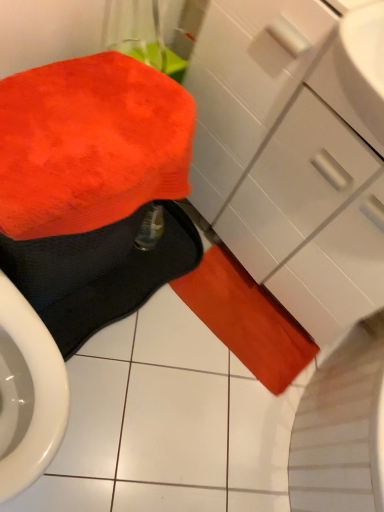
Question: Considering the relative positions of fluffy orange towel at lower left, which is the first bath towel in front-to-back order, and matte white drawer at center-right in the image provided, is fluffy orange towel at lower left, which is the first bath towel in front-to-back order, behind matte white drawer at center-right?

Choices:
 (A) no
 (B) yes

Answer: (A)

Question: Does fluffy orange towel at lower left, which is the first bath towel in front-to-back order, turn towards matte white drawer at center-right?

Choices:
 (A) yes
 (B) no

Answer: (B)

Question: From the image's perspective, does fluffy orange towel at lower left, which is counted as the 3th bath towel, starting from the back, appear higher than matte white drawer at center-right?

Choices:
 (A) no
 (B) yes

Answer: (A)

Question: Does fluffy orange towel at lower left, which is counted as the 3th bath towel, starting from the back, have a greater width compared to matte white drawer at center-right?

Choices:
 (A) no
 (B) yes

Answer: (A)

Question: From a real-world perspective, is fluffy orange towel at lower left, which is counted as the 3th bath towel, starting from the back, physically below matte white drawer at center-right?

Choices:
 (A) yes
 (B) no

Answer: (B)

Question: From a real-world perspective, is orange fuzzy bath towel at lower center, the 2th bath towel when ordered from back to front, above or below fluffy orange towel at lower left, which is the first bath towel in front-to-back order?

Choices:
 (A) above
 (B) below

Answer: (B)

Question: In the image, is orange fuzzy bath towel at lower center, the 2th bath towel when ordered from back to front, on the left side or the right side of fluffy orange towel at lower left, which is counted as the 3th bath towel, starting from the back?

Choices:
 (A) left
 (B) right

Answer: (B)

Question: Considering the positions of orange fuzzy bath towel at lower center, which is counted as the second bath towel, starting from the front, and fluffy orange towel at lower left, which is the first bath towel in front-to-back order, in the image, is orange fuzzy bath towel at lower center, which is counted as the second bath towel, starting from the front, taller or shorter than fluffy orange towel at lower left, which is the first bath towel in front-to-back order,?

Choices:
 (A) short
 (B) tall

Answer: (A)

Question: Looking at the image, does orange fuzzy bath towel at lower center, which is counted as the second bath towel, starting from the front, seem bigger or smaller compared to fluffy orange towel at lower left, which is the first bath towel in front-to-back order?

Choices:
 (A) big
 (B) small

Answer: (B)

Question: From a real-world perspective, is orange suede bath towel at lower center, the first bath towel in the back-to-front sequence, above or below fluffy orange towel at lower left, which is the first bath towel in front-to-back order?

Choices:
 (A) above
 (B) below

Answer: (B)

Question: In the image, is orange suede bath towel at lower center, the first bath towel in the back-to-front sequence, on the left side or the right side of fluffy orange towel at lower left, which is the first bath towel in front-to-back order?

Choices:
 (A) right
 (B) left

Answer: (A)

Question: In terms of height, does orange suede bath towel at lower center, the first bath towel in the back-to-front sequence, look taller or shorter compared to fluffy orange towel at lower left, which is the first bath towel in front-to-back order?

Choices:
 (A) tall
 (B) short

Answer: (B)

Question: Does point (286, 384) appear closer or farther from the camera than point (92, 97)?

Choices:
 (A) farther
 (B) closer

Answer: (A)

Question: Based on their sizes in the image, would you say orange suede bath towel at lower center, which is the 3th bath towel from front to back, is bigger or smaller than orange fuzzy bath towel at lower center, which is counted as the second bath towel, starting from the front?

Choices:
 (A) small
 (B) big

Answer: (A)

Question: Considering the positions of orange suede bath towel at lower center, which is the 3th bath towel from front to back, and orange fuzzy bath towel at lower center, the 2th bath towel when ordered from back to front, in the image, is orange suede bath towel at lower center, which is the 3th bath towel from front to back, taller or shorter than orange fuzzy bath towel at lower center, the 2th bath towel when ordered from back to front,?

Choices:
 (A) short
 (B) tall

Answer: (B)